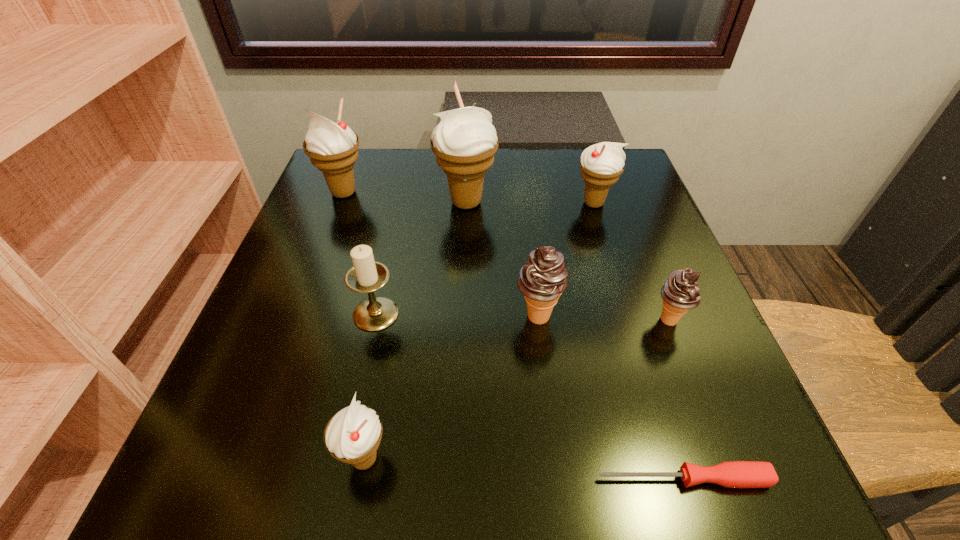
Where is `vacant space at the near edge of the desktop`? The image size is (960, 540). vacant space at the near edge of the desktop is located at coordinates (331, 458).

Locate an element on the screen. vacant space at the left edge of the desktop is located at coordinates (328, 271).

Image resolution: width=960 pixels, height=540 pixels. What are the coordinates of `vacant space at the right edge of the desktop` in the screenshot? It's located at (630, 244).

Locate an element on the screen. The width and height of the screenshot is (960, 540). free spot at the far left corner of the desktop is located at coordinates (335, 201).

This screenshot has height=540, width=960. I want to click on vacant region at the near left corner of the desktop, so (236, 504).

The image size is (960, 540). I want to click on vacant space at the far right corner of the desktop, so click(x=570, y=148).

The image size is (960, 540). Find the location of `free spot at the near right corner of the desktop`. free spot at the near right corner of the desktop is located at coordinates (677, 466).

The width and height of the screenshot is (960, 540). In order to click on vacant space in between the shortest object and the white candle holder in this screenshot , I will do `click(530, 396)`.

What are the coordinates of `vacant area that lies between the fifth object from left to right and the leftmost object` in the screenshot? It's located at (441, 254).

Image resolution: width=960 pixels, height=540 pixels. Find the location of `free point between the shortest object and the white candle holder`. free point between the shortest object and the white candle holder is located at coordinates (530, 396).